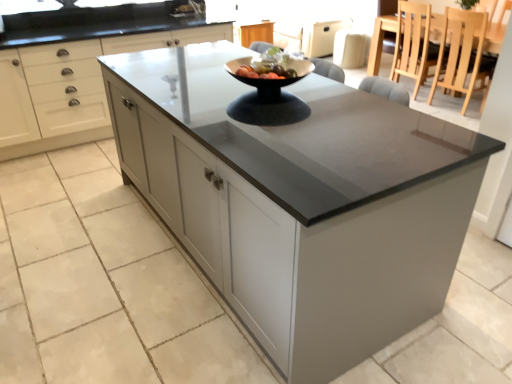
Question: In terms of height, does wooden dining table at upper right look taller or shorter compared to white glossy bowl at center?

Choices:
 (A) tall
 (B) short

Answer: (A)

Question: Considering their positions, is wooden dining table at upper right located in front of or behind white glossy bowl at center?

Choices:
 (A) behind
 (B) front

Answer: (A)

Question: Estimate the real-world distances between objects in this image. Which object is closer to the glossy glass bowl at center?

Choices:
 (A) light brown wooden chair at upper right, the first chair viewed from the back
 (B) matte white cabinets at center
 (C) wooden dining table at upper right
 (D) white glossy bowl at center
 (E) light wood chair at upper right, the 1th chair in the front-to-back sequence

Answer: (D)

Question: Which of these objects is positioned closest to the white glossy bowl at center?

Choices:
 (A) light brown wooden chair at upper right, the first chair viewed from the back
 (B) wooden dining table at upper right
 (C) matte white cabinets at center
 (D) light wood chair at upper right, marked as the second chair in a back-to-front arrangement
 (E) glossy glass bowl at center

Answer: (E)